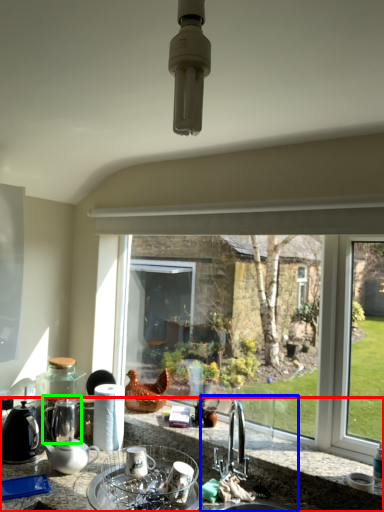
Question: Considering the real-world distances, which object is farthest from countertop (highlighted by a red box)? sink (highlighted by a blue box) or tea pot (highlighted by a green box)?

Choices:
 (A) sink
 (B) tea pot

Answer: (B)